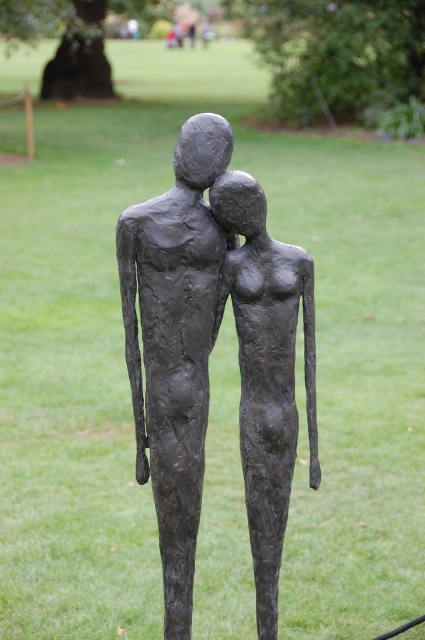
You are standing in the park where the two sculptures are located. You notice two points marked in the image. The first point is at coordinates point [195,324] and the second point is at point [246,180]. If you were to walk from the first point to the second point, would you be moving towards the sculptures or away from them?

Based on the coordinates provided, moving from point [195,324] to point [246,180] would mean moving towards the sculptures since point [195,324] is behind point [246,180], indicating that the second point is closer to the sculptures.

You are an art student analyzing the sculptures in the park. You notice two sculptures labeled as the matte bronze couple at center and the matte bronze figure at center. Which sculpture is taller?

The matte bronze couple at center is taller than the matte bronze figure at center.